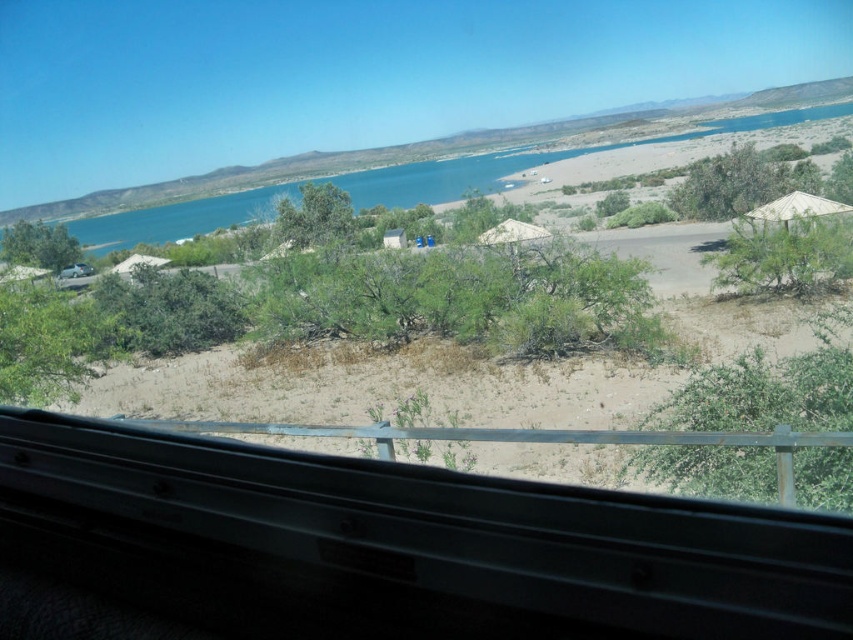
Where is `green leafy tree at right`? The width and height of the screenshot is (853, 640). green leafy tree at right is located at coordinates (786, 246).

Looking at this image, between green leafy tree at right and white matte hut at lower left, which one appears on the right side from the viewer's perspective?

Positioned to the right is green leafy tree at right.

Locate an element on the screen. The image size is (853, 640). green leafy tree at right is located at coordinates (786, 246).

Who is shorter, blue water at upper left or green leafy tree at left?

Standing shorter between the two is green leafy tree at left.

Between point (167, 221) and point (57, 250), which one is positioned in front?

Positioned in front is point (57, 250).

Identify the location of blue water at upper left. The image size is (853, 640). (521, 163).

The height and width of the screenshot is (640, 853). I want to click on blue water at upper left, so click(x=521, y=163).

Is green leafy bush at lower left to the left of green leafy tree at center from the viewer's perspective?

Indeed, green leafy bush at lower left is positioned on the left side of green leafy tree at center.

What do you see at coordinates (50, 342) in the screenshot? This screenshot has width=853, height=640. I see `green leafy bush at lower left` at bounding box center [50, 342].

Where is `green leafy bush at lower left`? green leafy bush at lower left is located at coordinates (50, 342).